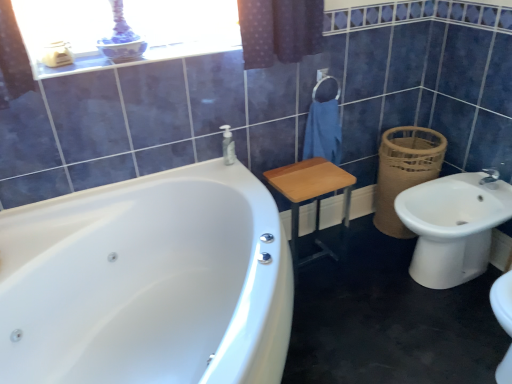
Question: Can you confirm if brown woven basket at right is bigger than white glossy balustrade at upper center?

Choices:
 (A) no
 (B) yes

Answer: (B)

Question: From a real-world perspective, is brown woven basket at right under white glossy balustrade at upper center?

Choices:
 (A) yes
 (B) no

Answer: (A)

Question: Considering the relative sizes of brown woven basket at right and white glossy balustrade at upper center in the image provided, is brown woven basket at right thinner than white glossy balustrade at upper center?

Choices:
 (A) yes
 (B) no

Answer: (B)

Question: Can you confirm if brown woven basket at right is shorter than white glossy balustrade at upper center?

Choices:
 (A) no
 (B) yes

Answer: (A)

Question: Does brown woven basket at right have a smaller size compared to white glossy balustrade at upper center?

Choices:
 (A) no
 (B) yes

Answer: (A)

Question: Is brown woven basket at right completely or partially outside of white glossy balustrade at upper center?

Choices:
 (A) yes
 (B) no

Answer: (A)

Question: Can you confirm if wooden stool at center is positioned to the right of white glossy balustrade at upper center?

Choices:
 (A) no
 (B) yes

Answer: (B)

Question: Is wooden stool at center positioned before white glossy balustrade at upper center?

Choices:
 (A) no
 (B) yes

Answer: (A)

Question: Considering the relative sizes of wooden stool at center and white glossy balustrade at upper center in the image provided, is wooden stool at center thinner than white glossy balustrade at upper center?

Choices:
 (A) no
 (B) yes

Answer: (A)

Question: From the image's perspective, would you say wooden stool at center is shown under white glossy balustrade at upper center?

Choices:
 (A) yes
 (B) no

Answer: (A)

Question: Can you confirm if wooden stool at center is taller than white glossy balustrade at upper center?

Choices:
 (A) yes
 (B) no

Answer: (A)

Question: Does wooden stool at center have a larger size compared to white glossy balustrade at upper center?

Choices:
 (A) no
 (B) yes

Answer: (B)

Question: Can you confirm if wooden stool at center is positioned to the left of white glossy bathtub at left?

Choices:
 (A) no
 (B) yes

Answer: (A)